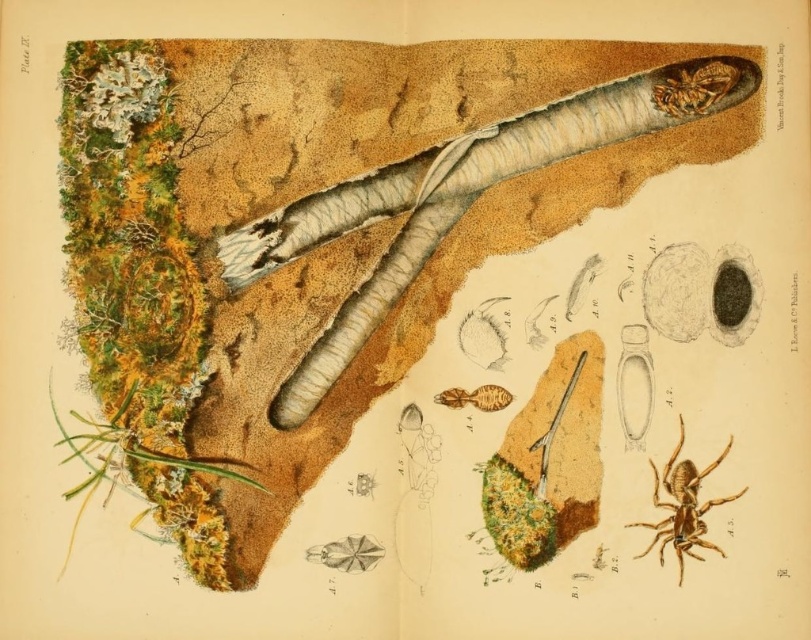
You are a researcher examining the burrow cross section. You notice the white textured worm at center and the shiny brown beetle at upper right. Which organism has a greater width according to the illustration?

The white textured worm at center has a greater width than the shiny brown beetle at upper right.

You are an entomologist examining the cross section of the burrow. You see a white textured worm at center and a translucent amber insect at center. Which organism has a larger width in this cross section?

The white textured worm at center is wider than the translucent amber insect at center according to the description.